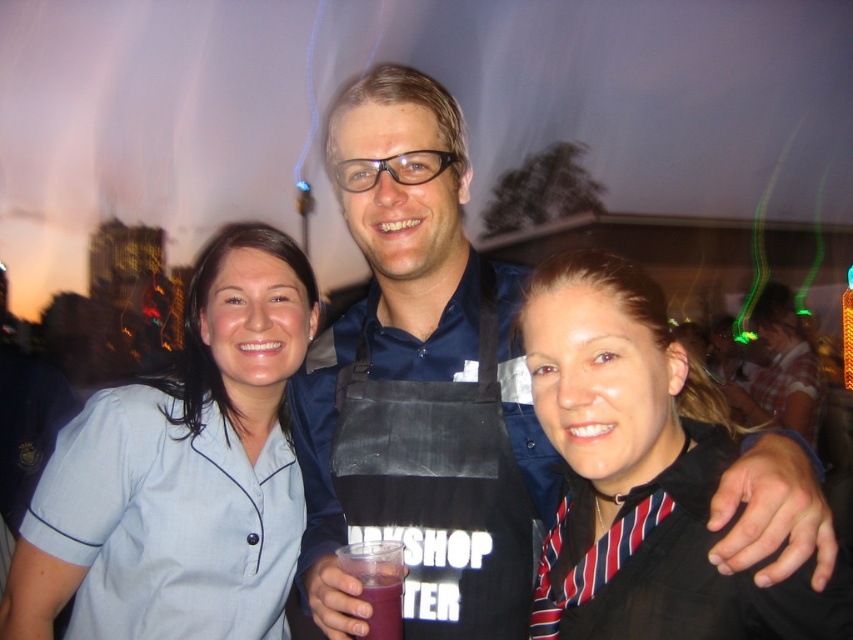
You are at an event and want to grab the purple translucent cup at center without touching the black apron at center. Is it possible?

The black apron at center is above the purple translucent cup at center, so you can reach the purple translucent cup at center without touching the apron by moving your hand underneath it.

You are a photographer at the event and want to ensure the blue fabric shirt at center and the black apron at center are both visible in the photo. Which one should you focus on to make sure the entire object is in frame?

The blue fabric shirt at center is taller than the black apron at center, so focusing on the blue fabric shirt at center will ensure both are visible as it requires a wider framing.

You are organizing a photo shoot and need to ensure that the black apron at center and the purple translucent cup at center are both visible in the frame. Given their sizes, which object might require more space in the photo composition?

The black apron at center requires more space in the photo composition because its width is larger than the purple translucent cup at center.